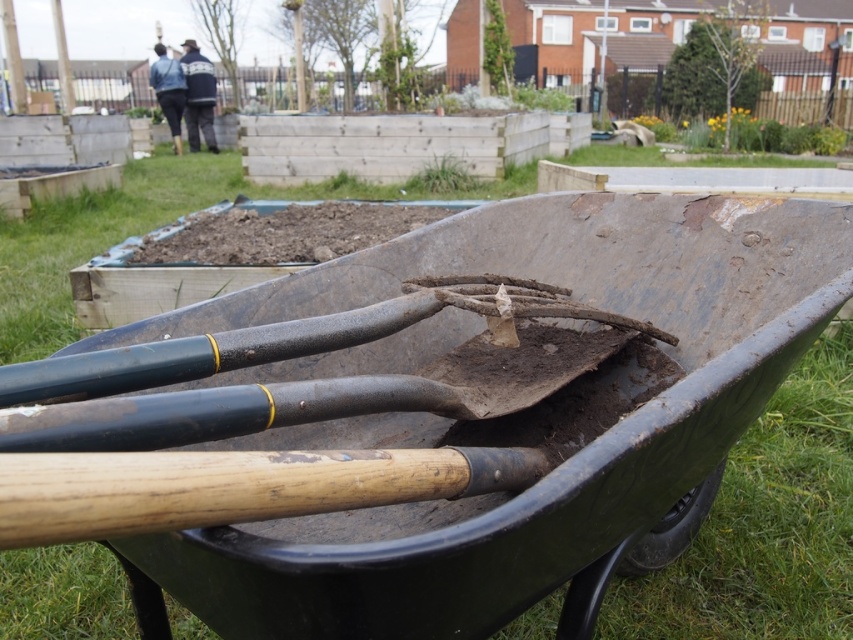
Question: Is green rubber cart at center to the right of brown soil at center from the viewer's perspective?

Choices:
 (A) no
 (B) yes

Answer: (B)

Question: Is green rubber cart at center below brown soil at center?

Choices:
 (A) yes
 (B) no

Answer: (A)

Question: Which point is farther from the camera taking this photo?

Choices:
 (A) (207, 515)
 (B) (328, 205)

Answer: (B)

Question: Which object is closer to the camera taking this photo?

Choices:
 (A) green rubber cart at center
 (B) brown soil at center

Answer: (A)

Question: Is green rubber cart at center thinner than brown soil at center?

Choices:
 (A) no
 (B) yes

Answer: (B)

Question: Which point is farther to the camera?

Choices:
 (A) (283, 592)
 (B) (271, 236)

Answer: (B)